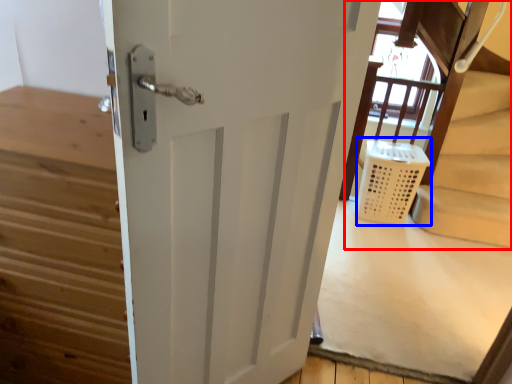
Question: Which object is closer to the camera taking this photo, bunk bed (highlighted by a red box) or laundry basket (highlighted by a blue box)?

Choices:
 (A) bunk bed
 (B) laundry basket

Answer: (A)